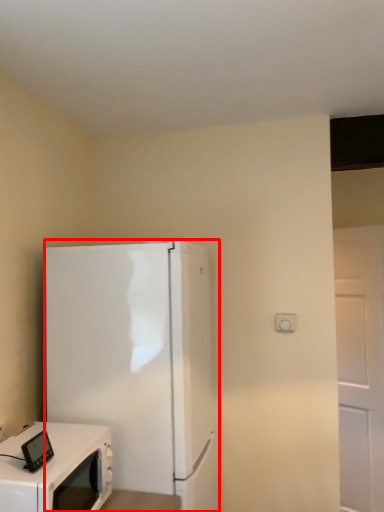
Question: From the image's perspective, what is the correct spatial relationship of refrigerator (annotated by the red box) in relation to home appliance?

Choices:
 (A) below
 (B) above

Answer: (B)